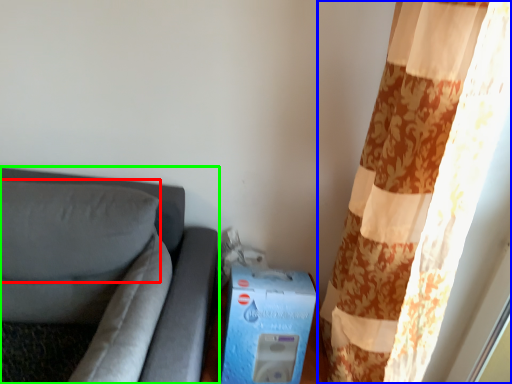
Question: Based on their relative distances, which object is nearer to pillow (highlighted by a red box)? Choose from curtain (highlighted by a blue box) and furniture (highlighted by a green box).

Choices:
 (A) curtain
 (B) furniture

Answer: (B)